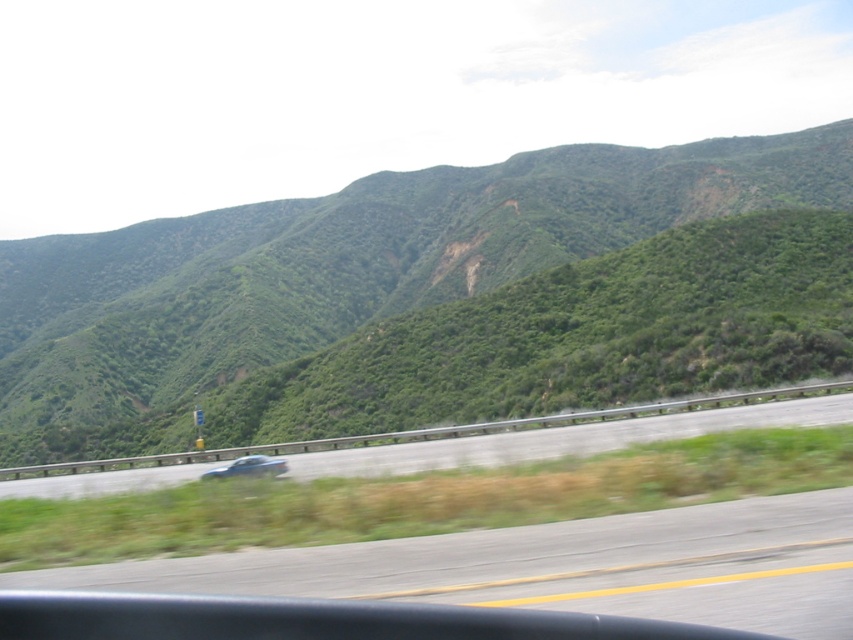
Question: Which point appears farthest from the camera in this image?

Choices:
 (A) (256, 472)
 (B) (355, 273)

Answer: (B)

Question: Is green leafy hillside at center to the right of metallic blue sedan at center from the viewer's perspective?

Choices:
 (A) yes
 (B) no

Answer: (B)

Question: Is green leafy hillside at center closer to camera compared to metallic blue sedan at center?

Choices:
 (A) yes
 (B) no

Answer: (B)

Question: Which point appears closest to the camera in this image?

Choices:
 (A) (439, 444)
 (B) (582, 241)
 (C) (254, 468)

Answer: (C)

Question: Is green leafy hillside at center bigger than gray asphalt highway at center?

Choices:
 (A) no
 (B) yes

Answer: (B)

Question: Which point is farther from the camera taking this photo?

Choices:
 (A) (425, 188)
 (B) (773, 401)
 (C) (219, 476)

Answer: (A)